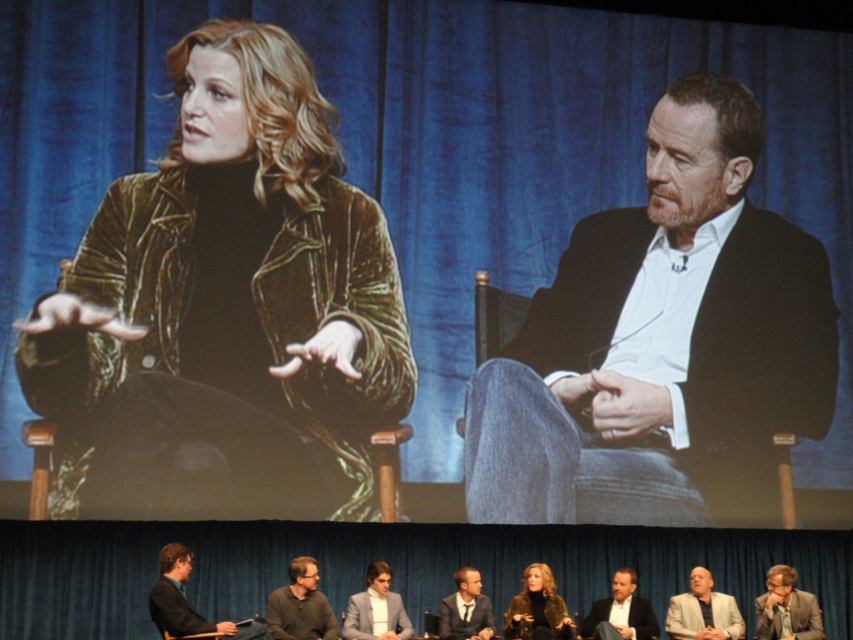
Question: Observing the image, what is the correct spatial positioning of light beige textured blazer at lower right in reference to matte gray suit at lower right?

Choices:
 (A) right
 (B) left

Answer: (B)

Question: Based on their relative distances, which object is farther from the dark gray suit at lower left?

Choices:
 (A) matte black jacket at lower right
 (B) matte black jacket at right

Answer: (B)

Question: Among these objects, which one is farthest from the camera?

Choices:
 (A) velvet green jacket at center
 (B) velvet brown jacket at center
 (C) gray suit at center
 (D) light beige textured blazer at lower right

Answer: (D)

Question: Among these objects, which one is nearest to the camera?

Choices:
 (A) gray suit at center
 (B) matte black jacket at lower right

Answer: (A)

Question: Can you confirm if matte black jacket at right is positioned to the left of matte black jacket at lower right?

Choices:
 (A) yes
 (B) no

Answer: (B)

Question: Is dark gray suit at lower left thinner than velvet brown jacket at center?

Choices:
 (A) yes
 (B) no

Answer: (B)